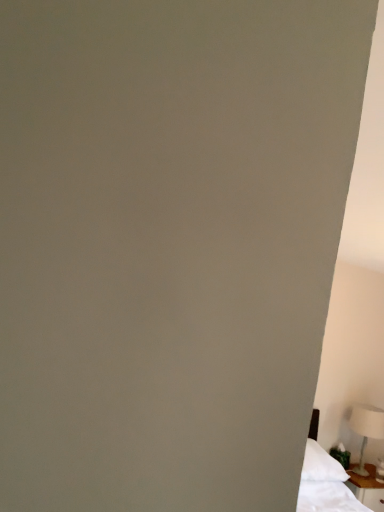
Question: Can you confirm if white wood nightstand at lower right is shorter than white plastic table lamp at lower right?

Choices:
 (A) yes
 (B) no

Answer: (A)

Question: Is white wood nightstand at lower right in front of white plastic table lamp at lower right?

Choices:
 (A) no
 (B) yes

Answer: (B)

Question: From a real-world perspective, is white wood nightstand at lower right positioned under white plastic table lamp at lower right based on gravity?

Choices:
 (A) no
 (B) yes

Answer: (B)

Question: Considering the relative sizes of white wood nightstand at lower right and white plastic table lamp at lower right in the image provided, is white wood nightstand at lower right smaller than white plastic table lamp at lower right?

Choices:
 (A) yes
 (B) no

Answer: (B)

Question: From the image's perspective, is white wood nightstand at lower right under white plastic table lamp at lower right?

Choices:
 (A) no
 (B) yes

Answer: (B)

Question: Is white wood nightstand at lower right placed right next to white plastic table lamp at lower right?

Choices:
 (A) no
 (B) yes

Answer: (A)

Question: Is white plastic table lamp at lower right smaller than white wood nightstand at lower right?

Choices:
 (A) no
 (B) yes

Answer: (B)

Question: From a real-world perspective, does white plastic table lamp at lower right sit lower than white wood nightstand at lower right?

Choices:
 (A) no
 (B) yes

Answer: (A)

Question: Could white wood nightstand at lower right be considered to be inside white plastic table lamp at lower right?

Choices:
 (A) no
 (B) yes

Answer: (A)

Question: Considering the relative sizes of white plastic table lamp at lower right and white wood nightstand at lower right in the image provided, is white plastic table lamp at lower right shorter than white wood nightstand at lower right?

Choices:
 (A) yes
 (B) no

Answer: (B)

Question: From a real-world perspective, is white plastic table lamp at lower right on top of white wood nightstand at lower right?

Choices:
 (A) no
 (B) yes

Answer: (B)

Question: Are white plastic table lamp at lower right and white wood nightstand at lower right located far from each other?

Choices:
 (A) no
 (B) yes

Answer: (A)

Question: Is white wood nightstand at lower right in front of or behind white plastic table lamp at lower right in the image?

Choices:
 (A) front
 (B) behind

Answer: (A)